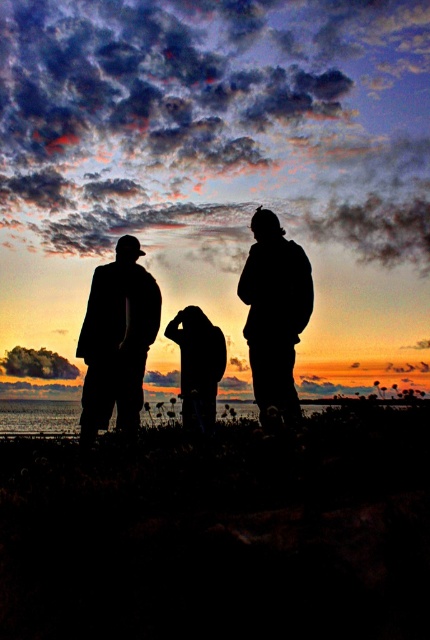
You are a photographer trying to capture the sunset scene. You notice the silhouette suit at left and the silhouette jacket at right. Which silhouette is wider in the image?

The silhouette suit at left is wider than the silhouette jacket at right in the image.

You are standing on the grassy beach at lower center and want to walk to the silhouette jacket at right. Is there enough space to move sideways without stepping into the water?

The grassy beach at lower center might be wider than silhouette jacket at right, so there could be enough space to move sideways without stepping into the water. However, the exact width isn not specified, so caution is advised.